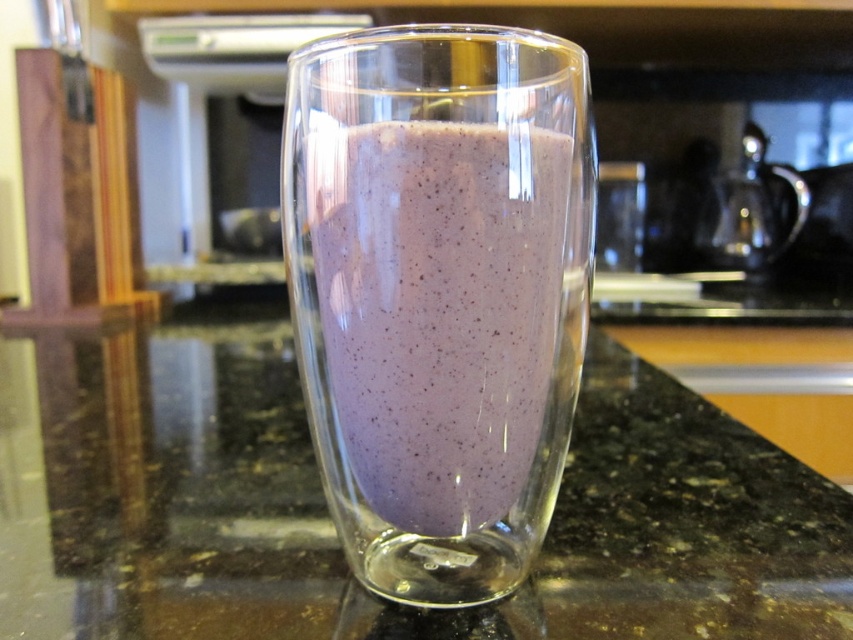
In the scene shown: You are a bartender preparing a drink and notice the purple glass at center and the purple smoothie at center. Which one is closer to you?

The purple glass at center is closer to you because the purple smoothie at center is behind it.

Based on the photo, you are trying to determine if the purple smoothie at center will spill over if you tilt the purple glass at center slightly. Based on their sizes, what should you consider?

The purple glass at center is wider than the purple smoothie at center, so tilting it might cause the smoothie to spill over since the glass has more width to accommodate the liquid when tilted.

You are a bartender preparing a drink. You have a purple glass at center and a purple smoothie at center in front of you. Which one is closer to the edge of the counter?

The purple smoothie at center is closer to the edge of the counter because the purple glass at center is above it, meaning the smoothie is inside the glass and thus positioned lower, nearer to the counter edge.